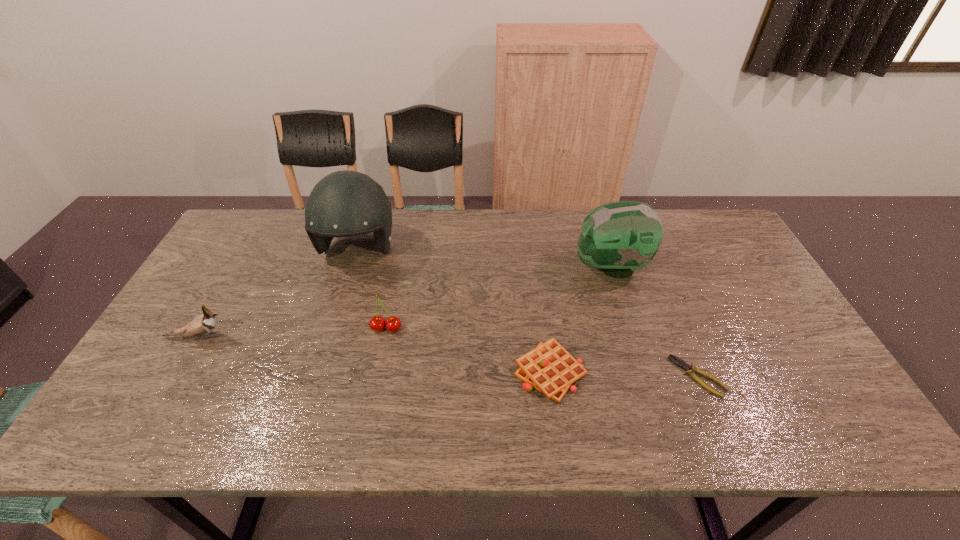
The width and height of the screenshot is (960, 540). Find the location of `blank space at the left edge of the desktop`. blank space at the left edge of the desktop is located at coordinates (234, 266).

Locate an element on the screen. free space at the right edge of the desktop is located at coordinates (748, 332).

In order to click on vacant area at the far right corner of the desktop in this screenshot , I will do `click(720, 252)`.

Image resolution: width=960 pixels, height=540 pixels. I want to click on unoccupied area between the fifth shortest object and the leftmost object, so click(x=404, y=302).

Where is `empty space that is in between the bird and the shortest object`? The width and height of the screenshot is (960, 540). empty space that is in between the bird and the shortest object is located at coordinates (448, 357).

Where is `free space between the bird and the left football helmet`? The image size is (960, 540). free space between the bird and the left football helmet is located at coordinates (278, 294).

Where is `vacant space that is in between the right football helmet and the bird`? The height and width of the screenshot is (540, 960). vacant space that is in between the right football helmet and the bird is located at coordinates (404, 302).

This screenshot has width=960, height=540. Identify the location of free spot between the shortest object and the bird. (448, 357).

The width and height of the screenshot is (960, 540). In order to click on free spot between the cherry and the leftmost object in this screenshot , I will do `click(293, 333)`.

I want to click on free spot between the waffle and the cherry, so click(x=468, y=350).